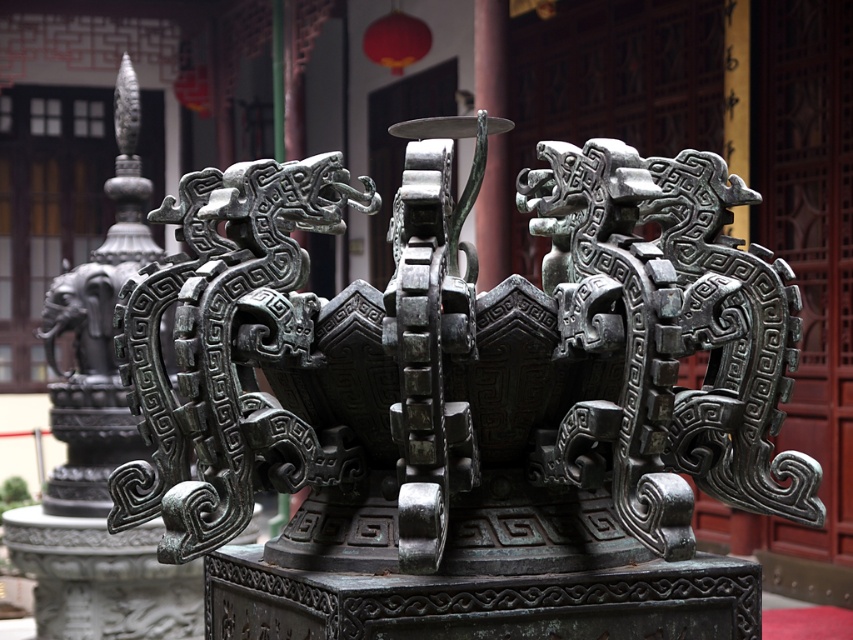
What are the coordinates of the green patina bronze sculpture at center?

The green patina bronze sculpture at center is located at coordinates point (463, 348).